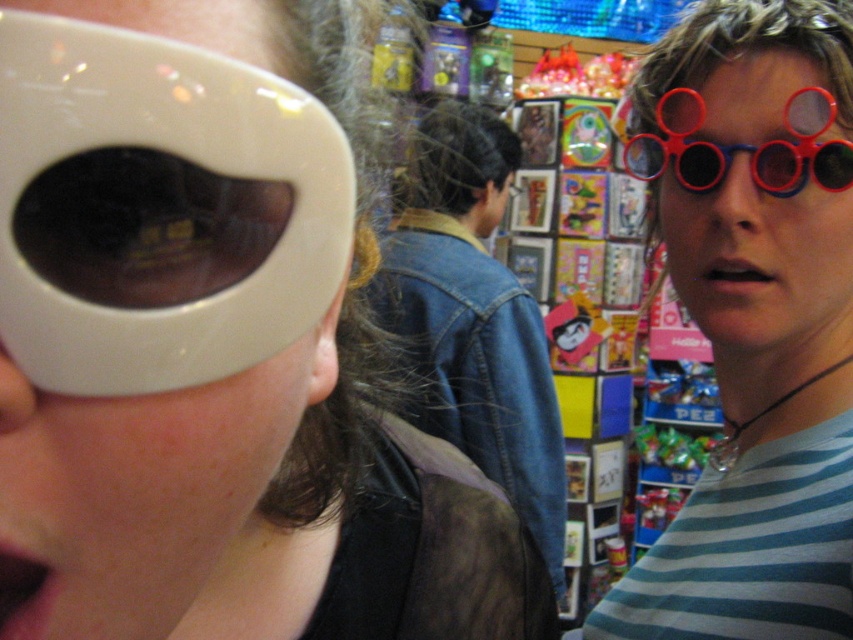
Does point (743, 428) come in front of point (57, 353)?

That is False.

Does matte plastic glasses at center have a smaller size compared to white glossy sunglasses at left?

No.

Does point (691, 586) come in front of point (138, 88)?

No, it is not.

Find the location of a particular element. matte plastic glasses at center is located at coordinates (755, 320).

Between red plastic goggles at upper right and matte black sunglasses at center, which one is positioned higher?

Positioned higher is matte black sunglasses at center.

This screenshot has height=640, width=853. I want to click on red plastic goggles at upper right, so click(x=744, y=147).

Describe the element at coordinates (744, 147) in the screenshot. The image size is (853, 640). I see `red plastic goggles at upper right` at that location.

At what (x,y) coordinates should I click in order to perform the action: click on red plastic goggles at upper right. Please return your answer as a coordinate pair (x, y). Looking at the image, I should click on (744, 147).

Can you confirm if pink flesh at lower left is wider than pink matte skin at center?

Incorrect, pink flesh at lower left's width does not surpass pink matte skin at center's.

Is point (4, 611) positioned before point (726, 259)?

That is True.

Find the location of a particular element. The height and width of the screenshot is (640, 853). pink flesh at lower left is located at coordinates (24, 589).